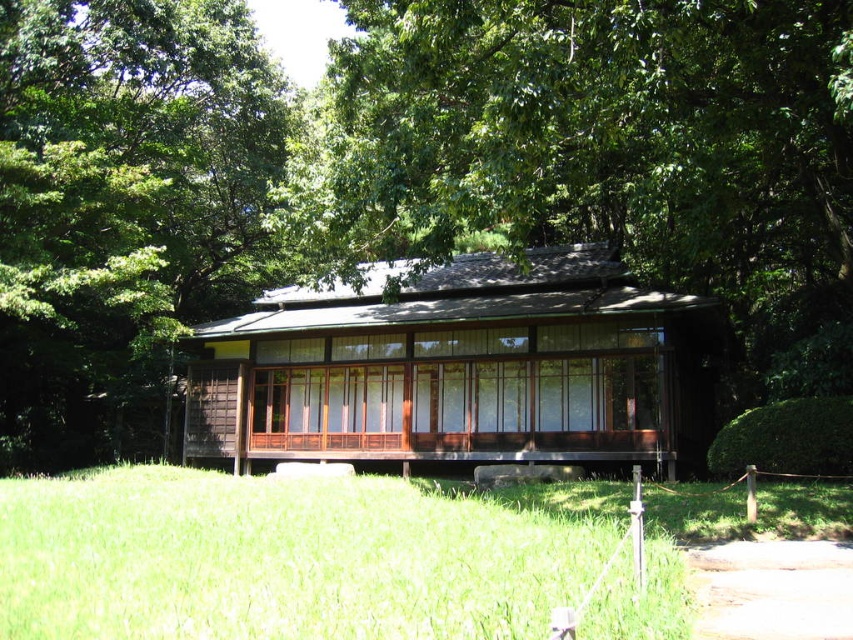
From the picture: You are standing outside the brown wooden cabin at center and want to step onto the green grass at center. Is there a clear path to walk directly from the cabin to the grass?

The green grass at center is positioned under brown wooden cabin at center, so stepping directly from the cabin to the grass would require walking downward since the grass is located beneath the cabin.